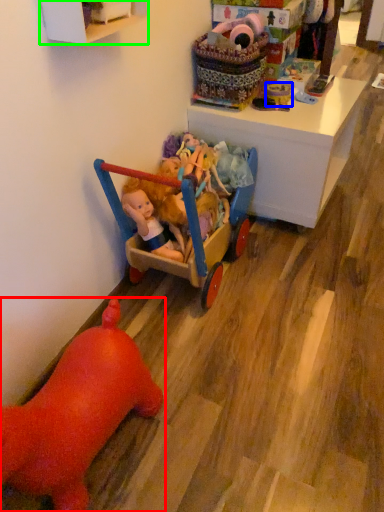
Question: Estimate the real-world distances between objects in this image. Which object is farther from toy (highlighted by a red box), toy (highlighted by a blue box) or cabinetry (highlighted by a green box)?

Choices:
 (A) toy
 (B) cabinetry

Answer: (A)